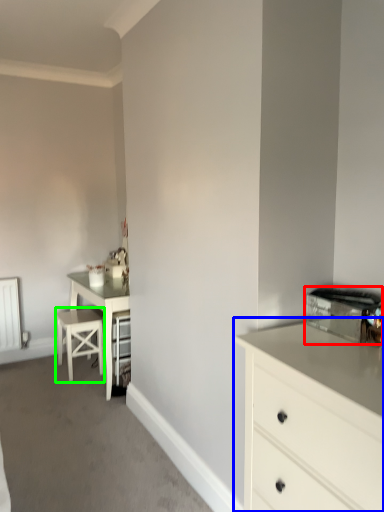
Question: Estimate the real-world distances between objects in this image. Which object is farther from appliance (highlighted by a red box), chest of drawers (highlighted by a blue box) or bar stool (highlighted by a green box)?

Choices:
 (A) chest of drawers
 (B) bar stool

Answer: (B)